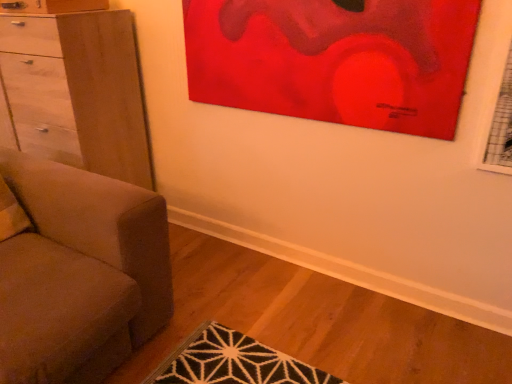
Locate an element on the screen. free area below matte red painting at upper center (from a real-world perspective) is located at coordinates (324, 248).